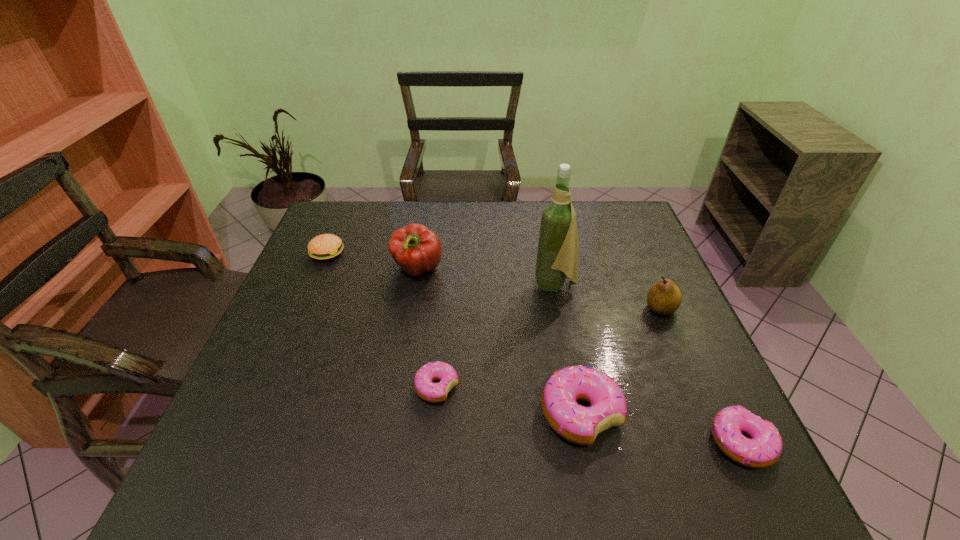
This screenshot has width=960, height=540. Identify the location of free space that is in between the patty and the pear. (493, 281).

You are a GUI agent. You are given a task and a screenshot of the screen. Output one action in this format:
    pyautogui.click(x=<x>, y=<y>)
    Task: Click on the vacant region between the leftmost doughnut and the leftmost object
    
    Given the screenshot: What is the action you would take?
    pyautogui.click(x=382, y=320)

Image resolution: width=960 pixels, height=540 pixels. Identify the location of vacant region between the fifth shortest object and the patty. (493, 281).

Find the location of a particular element. free space between the second doughnut from left to right and the third tallest object is located at coordinates pyautogui.click(x=621, y=361).

You are a GUI agent. You are given a task and a screenshot of the screen. Output one action in this format:
    pyautogui.click(x=<x>, y=<y>)
    Task: Click on the free space that is in between the second shortest doughnut and the leftmost object
    Image resolution: width=960 pixels, height=540 pixels.
    Given the screenshot: What is the action you would take?
    pyautogui.click(x=534, y=348)

Identify the location of vacant area between the second doughnut from left to right and the second shortest doughnut. (661, 428).

The width and height of the screenshot is (960, 540). Identify the location of free space between the tallest object and the tallest doughnut. (568, 349).

You are a GUI agent. You are given a task and a screenshot of the screen. Output one action in this format:
    pyautogui.click(x=<x>, y=<y>)
    Task: Click on the vacant region between the bell pepper and the fourth tallest object
    The height and width of the screenshot is (540, 960).
    Given the screenshot: What is the action you would take?
    pyautogui.click(x=499, y=342)

I want to click on unoccupied position between the shortest object and the patty, so click(x=382, y=320).

Identify the location of vacant space that's between the leftmost object and the rightmost doughnut. The image size is (960, 540). (534, 348).